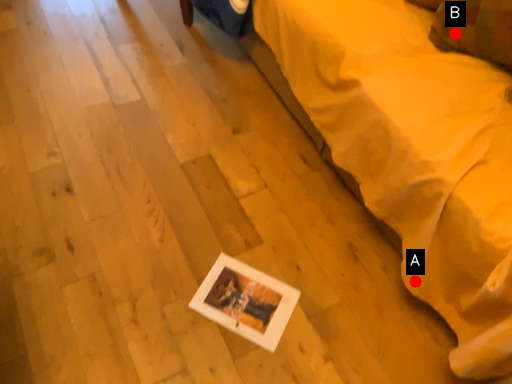
Question: Two points are circled on the image, labeled by A and B beside each circle. Which point is further to the camera?

Choices:
 (A) A is further
 (B) B is further

Answer: (B)